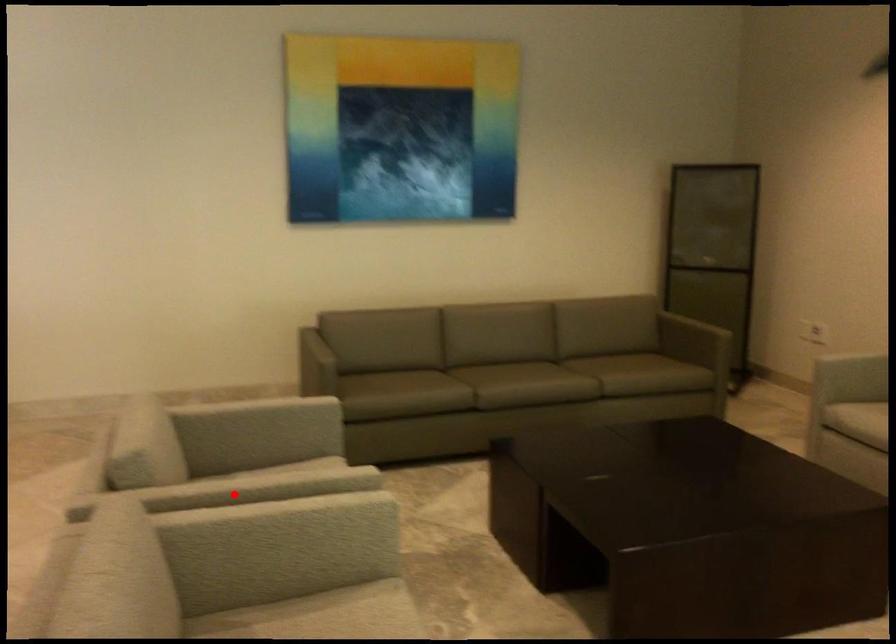
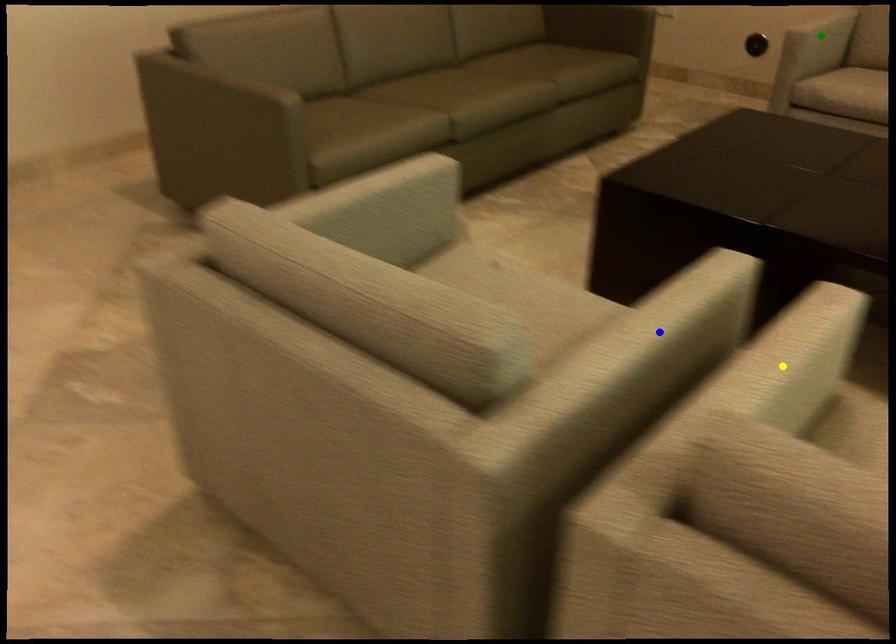
Question: I am providing you with two images of the same scene from different viewpoints. A red point is marked on the first image. You are given multiple points on the second image. Which mark in image 2 goes with the point in image 1?

Choices:
 (A) green point
 (B) yellow point
 (C) blue point

Answer: (C)